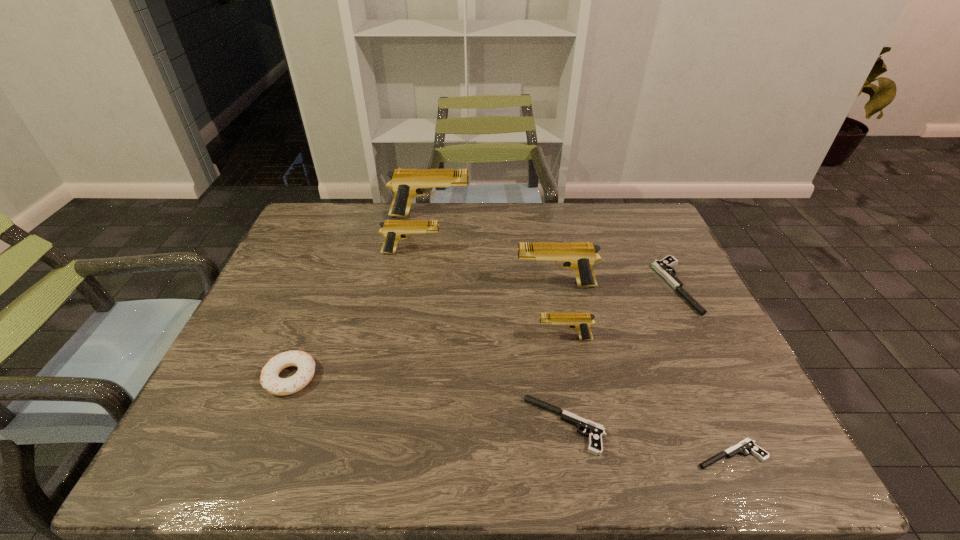
You are a GUI agent. You are given a task and a screenshot of the screen. Output one action in this format:
    pyautogui.click(x=<x>, y=<y>)
    Task: Click on the black pistol identified as the closest to the shortest object
    
    Given the screenshot: What is the action you would take?
    pyautogui.click(x=596, y=431)